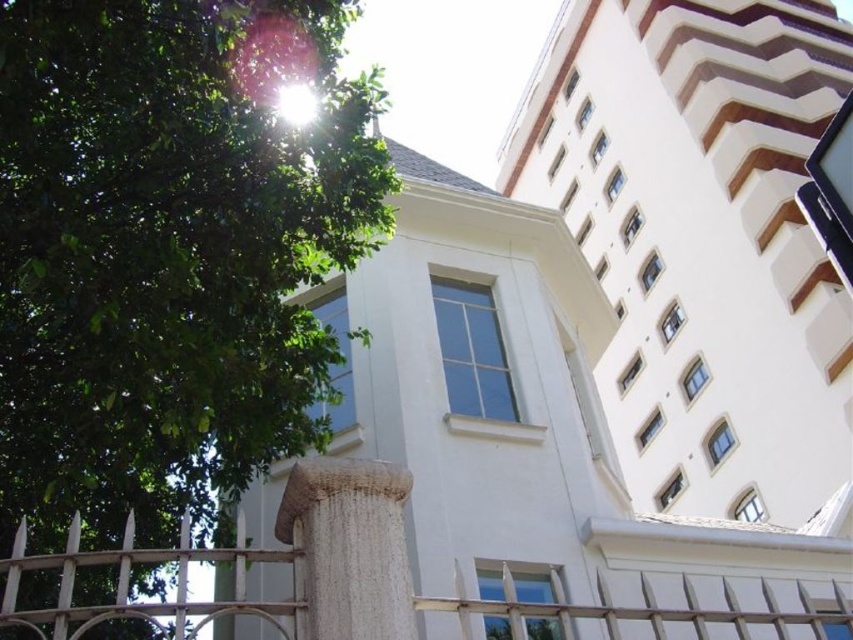
Is green leafy tree at upper left positioned in front of white metal fence at lower center?

No.

Is green leafy tree at upper left shorter than white metal fence at lower center?

In fact, green leafy tree at upper left may be taller than white metal fence at lower center.

Identify the location of green leafy tree at upper left. This screenshot has height=640, width=853. (169, 250).

Can you confirm if white smooth building at center is thinner than white metal fence at lower center?

In fact, white smooth building at center might be wider than white metal fence at lower center.

Who is more distant from viewer, [469,230] or [292,612]?

The point [469,230] is more distant.

Which is in front, point (426, 442) or point (608, 632)?

Point (608, 632) is in front.

At what (x,y) coordinates should I click in order to perform the action: click on white smooth building at center. Please return your answer as a coordinate pair (x, y). This screenshot has width=853, height=640. Looking at the image, I should click on (515, 406).

Measure the distance between point (440, 589) and camera.

7.69 meters

Can you confirm if white smooth building at center is smaller than woven fabric pillar at lower center?

No.

Identify the location of white smooth building at center. Image resolution: width=853 pixels, height=640 pixels. (515, 406).

The image size is (853, 640). I want to click on white smooth building at center, so click(515, 406).